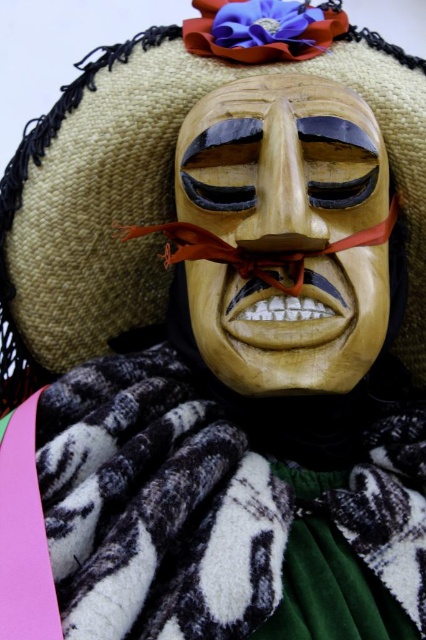
Between wooden mask at center and red silk ribbon at center, which one has less height?

Standing shorter between the two is red silk ribbon at center.

Find the location of a particular element. Image resolution: width=426 pixels, height=640 pixels. wooden mask at center is located at coordinates [284, 234].

Identify the location of wooden mask at center. Image resolution: width=426 pixels, height=640 pixels. (284, 234).

Identify the location of wooden mask at center. Image resolution: width=426 pixels, height=640 pixels. (284, 234).